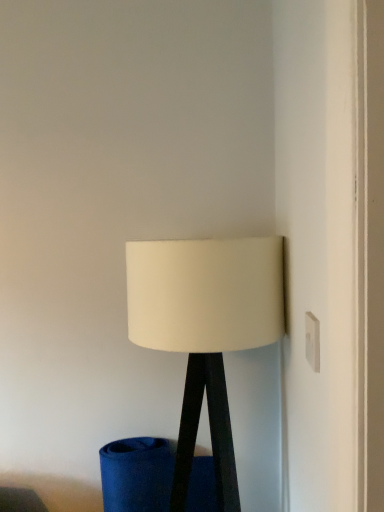
Describe the element at coordinates (312, 341) in the screenshot. Image resolution: width=384 pixels, height=512 pixels. I see `white plastic electric outlet at upper right` at that location.

In order to face white plastic electric outlet at upper right, should I rotate leftwards or rightwards?

A 15.616 degree turn to the right will do.

The width and height of the screenshot is (384, 512). I want to click on white plastic electric outlet at upper right, so click(x=312, y=341).

What is the approximate width of white plastic electric outlet at upper right?

It is 0.51 inches.

Describe the element at coordinates (205, 330) in the screenshot. I see `white matte lampshade at center` at that location.

Identify the location of white matte lampshade at center. coord(205,330).

Locate an element on the screen. This screenshot has height=512, width=384. white plastic electric outlet at upper right is located at coordinates (312, 341).

Is white matte lampshade at center at the left side of white plastic electric outlet at upper right?

Indeed, white matte lampshade at center is positioned on the left side of white plastic electric outlet at upper right.

In the image, is white matte lampshade at center positioned in front of or behind white plastic electric outlet at upper right?

white matte lampshade at center is behind white plastic electric outlet at upper right.

Is point (211, 253) positioned before point (316, 323)?

That is False.

From the image's perspective, is white matte lampshade at center on white plastic electric outlet at upper right?

Actually, white matte lampshade at center appears below white plastic electric outlet at upper right in the image.

In the scene shown: From a real-world perspective, which object rests below the other?

white matte lampshade at center.

Considering the sizes of objects white matte lampshade at center and white plastic electric outlet at upper right in the image provided, who is thinner, white matte lampshade at center or white plastic electric outlet at upper right?

white plastic electric outlet at upper right.

Can you confirm if white matte lampshade at center is taller than white plastic electric outlet at upper right?

Yes, white matte lampshade at center is taller than white plastic electric outlet at upper right.

Which of these two, white matte lampshade at center or white plastic electric outlet at upper right, is bigger?

Bigger between the two is white matte lampshade at center.

Is white matte lampshade at center completely or partially outside of white plastic electric outlet at upper right?

white matte lampshade at center is positioned outside white plastic electric outlet at upper right.

From the picture: Can you see white matte lampshade at center touching white plastic electric outlet at upper right?

No, white matte lampshade at center is not beside white plastic electric outlet at upper right.

Is white matte lampshade at center looking in the opposite direction of white plastic electric outlet at upper right?

No, white plastic electric outlet at upper right is not at the back of white matte lampshade at center.

How many degrees apart are the facing directions of white matte lampshade at center and white plastic electric outlet at upper right?

The angle between the facing direction of white matte lampshade at center and the facing direction of white plastic electric outlet at upper right is 89.7 degrees.

How distant is white matte lampshade at center from white plastic electric outlet at upper right?

The distance of white matte lampshade at center from white plastic electric outlet at upper right is 15.84 inches.

The image size is (384, 512). What are the coordinates of `electric outlet above the white matte lampshade at center (from a real-world perspective)` in the screenshot? It's located at (312, 341).

Visually, is white plastic electric outlet at upper right positioned to the left or to the right of white matte lampshade at center?

In the image, white plastic electric outlet at upper right appears on the right side of white matte lampshade at center.

Who is more distant, white plastic electric outlet at upper right or white matte lampshade at center?

white matte lampshade at center is more distant.

Is point (314, 359) closer or farther from the camera than point (228, 458)?

Clearly, point (314, 359) is closer to the camera than point (228, 458).

From the image's perspective, is white plastic electric outlet at upper right above or below white matte lampshade at center?

white plastic electric outlet at upper right is situated higher than white matte lampshade at center in the image.

From a real-world perspective, relative to white matte lampshade at center, is white plastic electric outlet at upper right vertically above or below?

In terms of real-world spatial position, white plastic electric outlet at upper right is above white matte lampshade at center.

Looking at their sizes, would you say white plastic electric outlet at upper right is wider or thinner than white matte lampshade at center?

In the image, white plastic electric outlet at upper right appears to be more narrow than white matte lampshade at center.

Can you confirm if white plastic electric outlet at upper right is taller than white matte lampshade at center?

No, white plastic electric outlet at upper right is not taller than white matte lampshade at center.

In terms of size, does white plastic electric outlet at upper right appear bigger or smaller than white matte lampshade at center?

white plastic electric outlet at upper right is smaller than white matte lampshade at center.

Is white plastic electric outlet at upper right located outside white matte lampshade at center?

Yes, white plastic electric outlet at upper right is located beyond the bounds of white matte lampshade at center.

Would you consider white plastic electric outlet at upper right to be distant from white matte lampshade at center?

No, there isn't a large distance between white plastic electric outlet at upper right and white matte lampshade at center.

Is white plastic electric outlet at upper right facing away from white matte lampshade at center?

No, white plastic electric outlet at upper right's orientation is not away from white matte lampshade at center.

Measure the distance from white plastic electric outlet at upper right to white matte lampshade at center.

white plastic electric outlet at upper right is 15.84 inches away from white matte lampshade at center.

Identify the location of lamp behind the white plastic electric outlet at upper right. (205, 330).

Image resolution: width=384 pixels, height=512 pixels. I want to click on electric outlet on the right of white matte lampshade at center, so click(x=312, y=341).

The image size is (384, 512). I want to click on electric outlet that appears above the white matte lampshade at center (from a real-world perspective), so click(x=312, y=341).